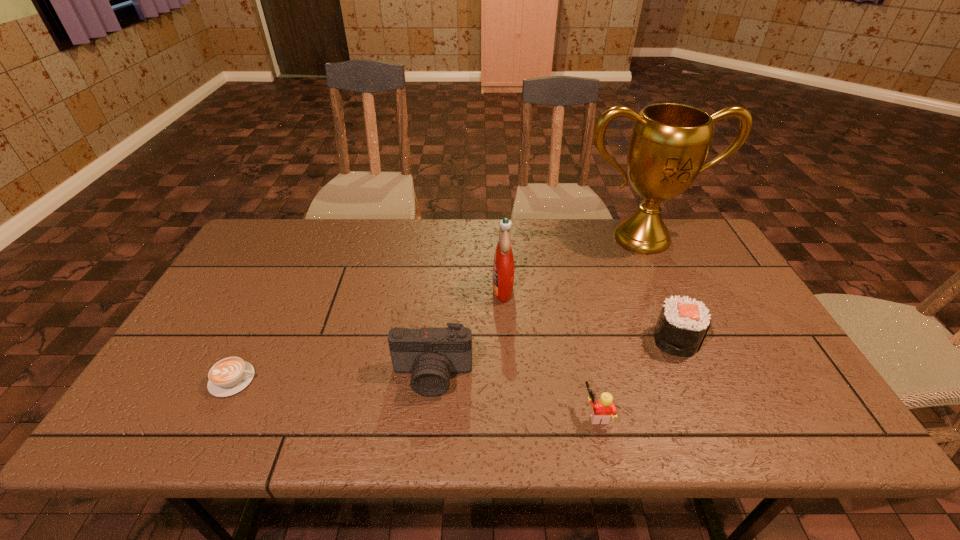
The height and width of the screenshot is (540, 960). I want to click on free space located 0.130m on the surface of the tallest object with symbols, so pyautogui.click(x=664, y=286).

Identify the location of free space located 0.390m on the front surface of the second farthest object. (358, 288).

I want to click on vacant space located 0.200m on the front surface of the second farthest object, so click(423, 288).

Locate an element on the screen. vacant point located 0.220m on the front surface of the second farthest object is located at coordinates (417, 288).

Image resolution: width=960 pixels, height=540 pixels. Identify the location of vacant space located at the lens of the second object from left to right. (427, 425).

You are a GUI agent. You are given a task and a screenshot of the screen. Output one action in this format:
    pyautogui.click(x=<x>, y=<y>)
    Task: Click on the free space located on the left of the sushi
    Image resolution: width=960 pixels, height=540 pixels.
    Given the screenshot: What is the action you would take?
    pyautogui.click(x=630, y=340)

This screenshot has width=960, height=540. What are the coordinates of `free space located in front of the Lego with the accessory visible` in the screenshot? It's located at pyautogui.click(x=516, y=414).

You are a GUI agent. You are given a task and a screenshot of the screen. Output one action in this format:
    pyautogui.click(x=<x>, y=<y>)
    Task: Click on the free region located 0.240m in front of the Lego with the accessory visible
    
    Given the screenshot: What is the action you would take?
    pyautogui.click(x=474, y=414)

Where is `vacant area situated 0.160m in front of the Lego with the accessory visible`? The image size is (960, 540). vacant area situated 0.160m in front of the Lego with the accessory visible is located at coordinates (511, 414).

This screenshot has height=540, width=960. Identify the location of free space located 0.180m on the side of the shortest object with the handle. (332, 380).